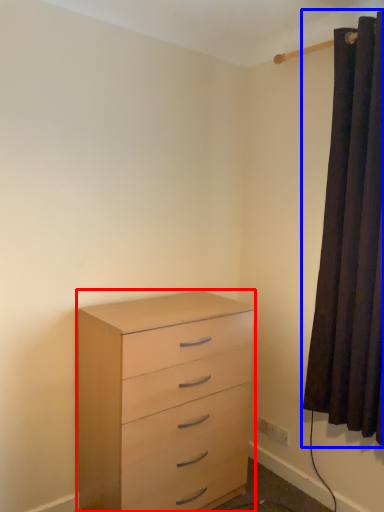
Question: Which of the following is the closest to the observer, chest of drawers (highlighted by a red box) or curtain (highlighted by a blue box)?

Choices:
 (A) chest of drawers
 (B) curtain

Answer: (B)